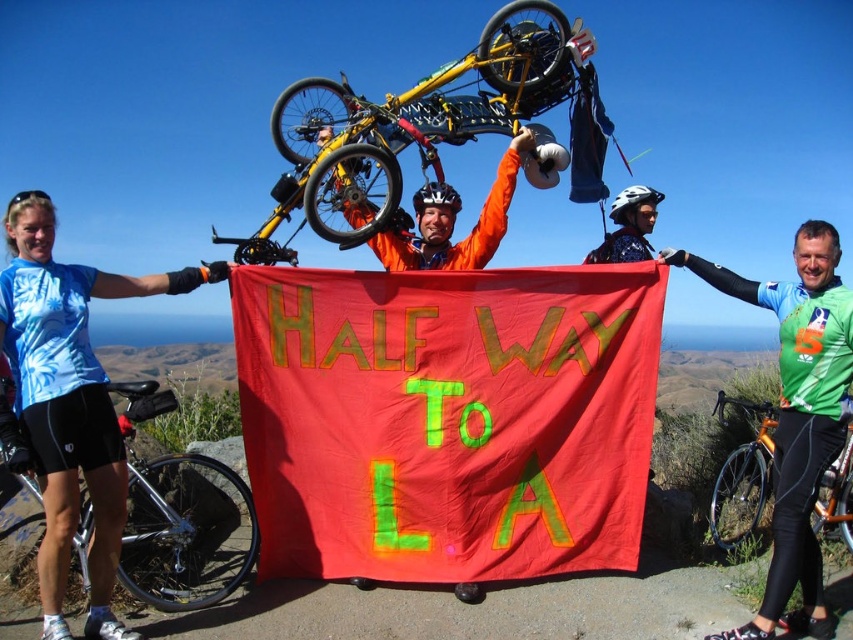
You are a photographer trying to capture a photo of the cyclists. You want to ensure both the shiny silver bicycle at lower left and the orange metallic bicycle at center are clearly visible in the frame. Based on their positions, which bicycle is closer to the camera?

The shiny silver bicycle at lower left is positioned under the orange metallic bicycle at center, meaning it is closer to the camera.

In the scene shown: You are a photographer at the scene. You need to capture a photo where both the green jersey at center and the blue fabric head at upper left are visible. Which object should you adjust your camera angle to prioritize to ensure both are in frame without cropping?

Since the green jersey at center is wider than the blue fabric head at upper left, you should prioritize adjusting your camera angle to accommodate the wider green jersey at center first to ensure both objects fit without cropping.

Based on the scene description and the coordinates provided, which object corresponds to the point labeled as point (408, 125)?

The point (408, 125) corresponds to the yellow matte mountain bike at upper center.